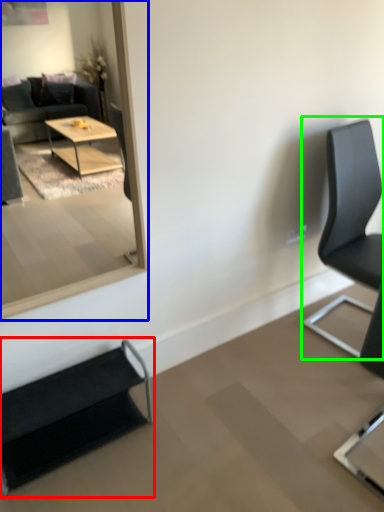
Question: Estimate the real-world distances between objects in this image. Which object is closer to chair (highlighted by a red box), mirror (highlighted by a blue box) or chair (highlighted by a green box)?

Choices:
 (A) mirror
 (B) chair

Answer: (B)